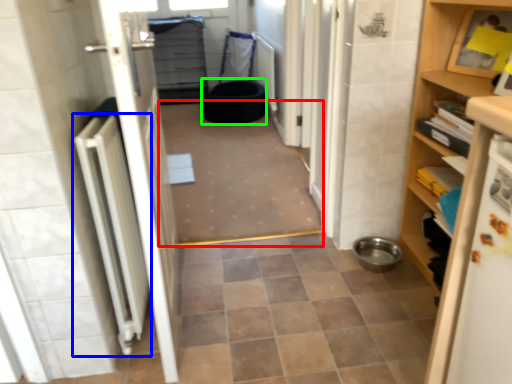
Question: Which object is positioned closest to plain (highlighted by a red box)? Select from radiator (highlighted by a blue box) and toilet bowl (highlighted by a green box).

Choices:
 (A) radiator
 (B) toilet bowl

Answer: (B)